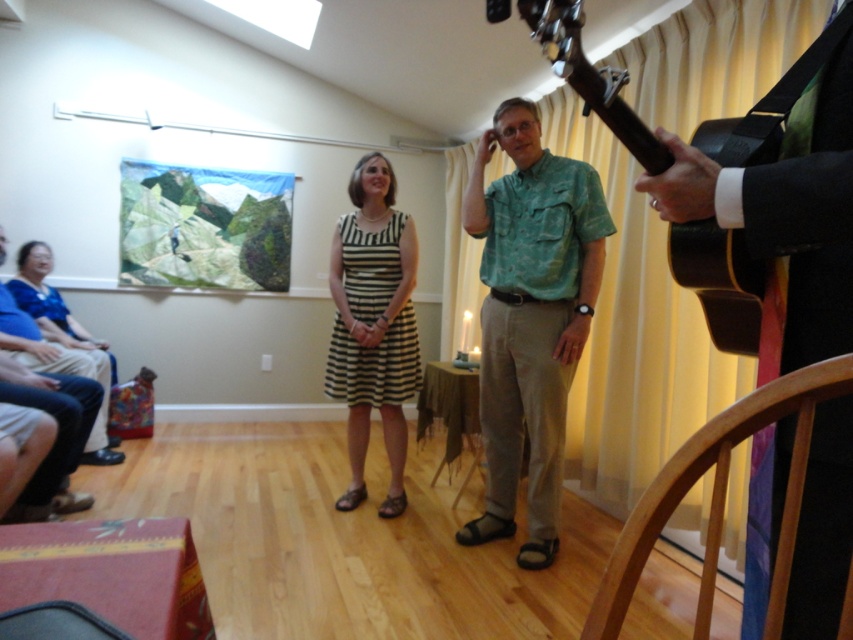
Please look at the image. There is a point at coordinate (531, 316). What object is located at this point?

The green textured shirt at center is located at point (531, 316).

You are at a party and want to take a photo of both the shiny black guitar at center and the matte blue dress at left. Where should you position yourself to capture both in the frame?

Position yourself to the left of the shiny black guitar at center so that the matte blue dress at left is on your right side and the shiny black guitar at center is centered in the frame.

You are at a party and want to introduce yourself to the two people in the image. The green textured shirt at center and the striped fabric dress at center are standing in a certain position. Which one should you approach first if you want to greet the person who is on the left side?

The striped fabric dress at center is on the left side, so you should approach the striped fabric dress at center first to greet the person on the left.